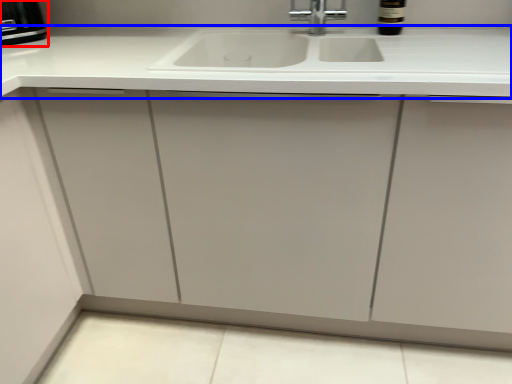
Question: Which object is closer to the camera taking this photo, appliance (highlighted by a red box) or countertop (highlighted by a blue box)?

Choices:
 (A) appliance
 (B) countertop

Answer: (B)